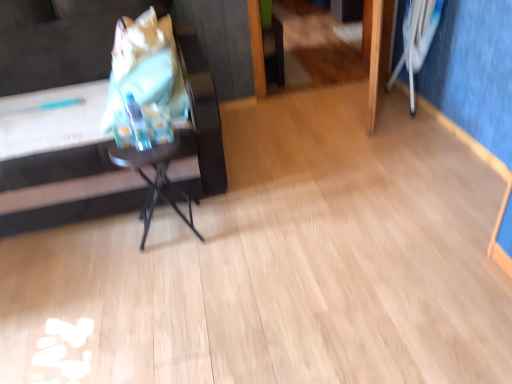
Question: Is matte black side table at left not close to metallic black table at center?

Choices:
 (A) no
 (B) yes

Answer: (A)

Question: Is metallic black table at center located within matte black side table at left?

Choices:
 (A) no
 (B) yes

Answer: (A)

Question: Is matte black side table at left behind metallic black table at center?

Choices:
 (A) yes
 (B) no

Answer: (B)

Question: Considering the relative positions of matte black side table at left and metallic black table at center in the image provided, is matte black side table at left to the right of metallic black table at center from the viewer's perspective?

Choices:
 (A) yes
 (B) no

Answer: (B)

Question: Considering the relative sizes of matte black side table at left and metallic black table at center in the image provided, is matte black side table at left shorter than metallic black table at center?

Choices:
 (A) yes
 (B) no

Answer: (B)

Question: From a real-world perspective, is white fabric swivel chair at upper right above or below metallic black table at center?

Choices:
 (A) above
 (B) below

Answer: (A)

Question: From the image's perspective, is white fabric swivel chair at upper right positioned above or below metallic black table at center?

Choices:
 (A) below
 (B) above

Answer: (B)

Question: Considering their positions, is white fabric swivel chair at upper right located in front of or behind metallic black table at center?

Choices:
 (A) behind
 (B) front

Answer: (A)

Question: Is white fabric swivel chair at upper right inside the boundaries of metallic black table at center, or outside?

Choices:
 (A) outside
 (B) inside

Answer: (A)

Question: From their relative heights in the image, would you say metallic black table at center is taller or shorter than matte plastic grocery bag at left?

Choices:
 (A) tall
 (B) short

Answer: (A)

Question: Is point (185, 195) closer or farther from the camera than point (126, 87)?

Choices:
 (A) closer
 (B) farther

Answer: (A)

Question: From a real-world perspective, is metallic black table at center positioned above or below matte plastic grocery bag at left?

Choices:
 (A) above
 (B) below

Answer: (B)

Question: Looking at the image, does metallic black table at center seem bigger or smaller compared to matte plastic grocery bag at left?

Choices:
 (A) big
 (B) small

Answer: (B)

Question: Is matte black side table at left in front of or behind white fabric swivel chair at upper right in the image?

Choices:
 (A) front
 (B) behind

Answer: (A)

Question: Considering the positions of point (65, 170) and point (415, 41), is point (65, 170) closer or farther from the camera than point (415, 41)?

Choices:
 (A) closer
 (B) farther

Answer: (A)